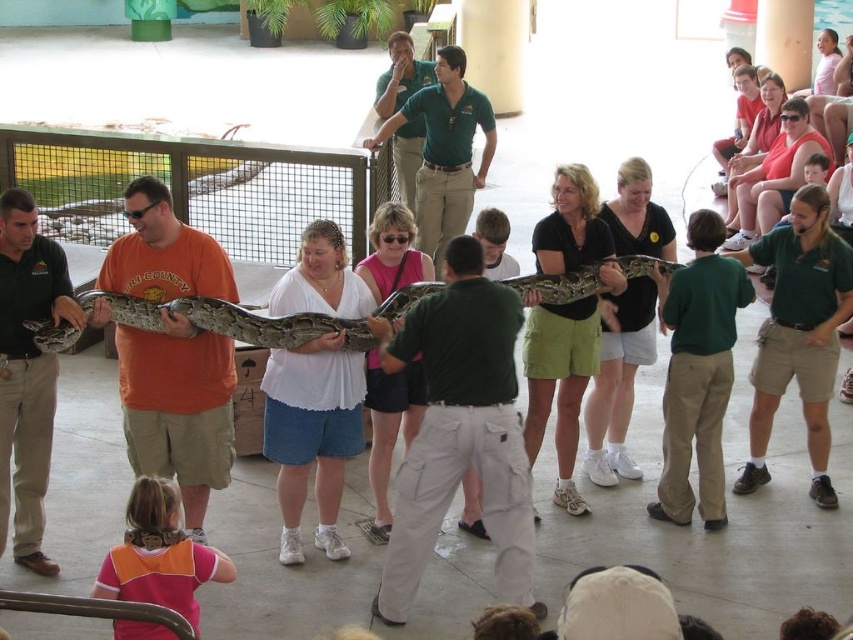
Describe the element at coordinates (178, 410) in the screenshot. The image size is (853, 640). I see `orange cotton shirt at center` at that location.

Can you confirm if orange cotton shirt at center is positioned below matte black shirt at center?

Yes.

Is point (216, 291) positioned behind point (567, 417)?

No, (216, 291) is in front of (567, 417).

At what (x,y) coordinates should I click in order to perform the action: click on orange cotton shirt at center. Please return your answer as a coordinate pair (x, y). The width and height of the screenshot is (853, 640). Looking at the image, I should click on (178, 410).

Does orange cotton shirt at center appear on the right side of camouflage snake at center?

Incorrect, orange cotton shirt at center is not on the right side of camouflage snake at center.

Between orange cotton shirt at center and camouflage snake at center, which one has less height?

With less height is camouflage snake at center.

Who is more distant from viewer, (142, 420) or (32, 321)?

The point (142, 420) is behind.

In order to click on orange cotton shirt at center in this screenshot , I will do `click(178, 410)`.

Identify the location of camouflage snake at center. Image resolution: width=853 pixels, height=640 pixels. (233, 321).

Can you confirm if camouflage snake at center is thinner than shiny brown snake at center?

In fact, camouflage snake at center might be wider than shiny brown snake at center.

This screenshot has width=853, height=640. I want to click on camouflage snake at center, so click(x=233, y=321).